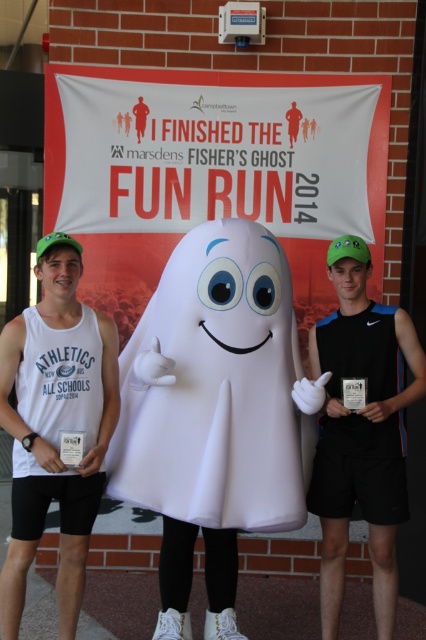
Question: Is white fabric ghost at center closer to camera compared to black matte tank top at center?

Choices:
 (A) no
 (B) yes

Answer: (B)

Question: Which of the following is the closest to the observer?

Choices:
 (A) (175, 275)
 (B) (71, 340)

Answer: (B)

Question: Which point appears closest to the camera in this image?

Choices:
 (A) (330, 545)
 (B) (141, 388)

Answer: (B)

Question: Can you confirm if white matte tank top at left is smaller than black matte tank top at center?

Choices:
 (A) yes
 (B) no

Answer: (A)

Question: Which point appears closest to the camera in this image?

Choices:
 (A) (311, 346)
 (B) (221, 413)
 (C) (9, 417)

Answer: (B)

Question: Is white fabric ghost at center to the right of white matte tank top at left from the viewer's perspective?

Choices:
 (A) yes
 (B) no

Answer: (A)